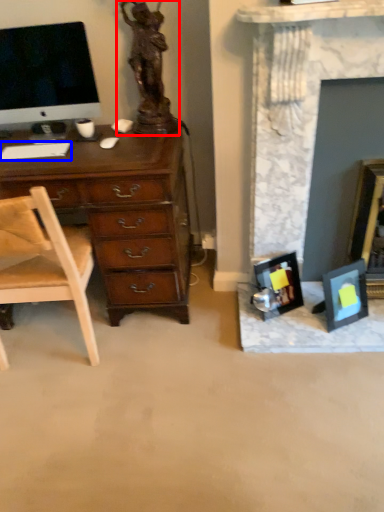
Question: Which object appears farthest to the camera in this image, sculpture (highlighted by a red box) or computer keyboard (highlighted by a blue box)?

Choices:
 (A) sculpture
 (B) computer keyboard

Answer: (B)